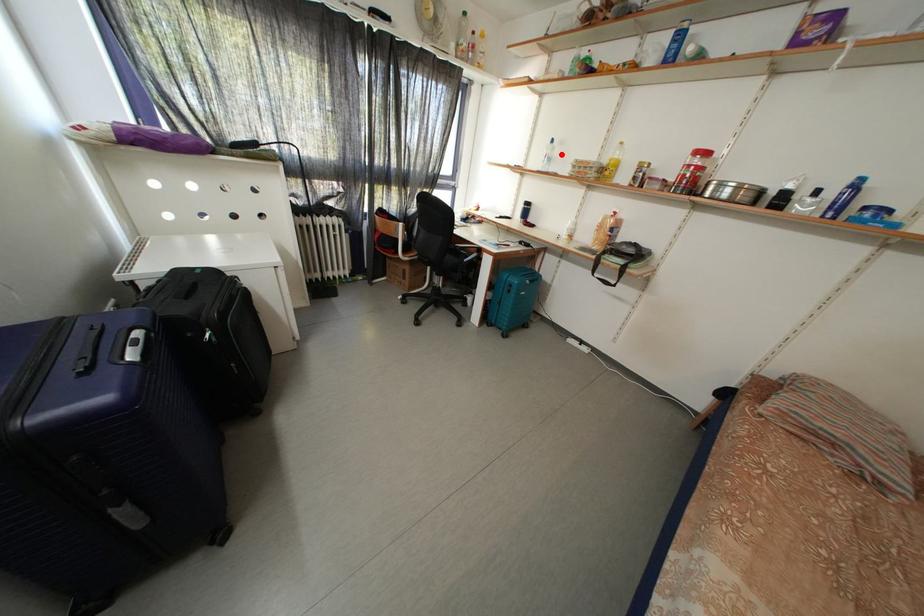
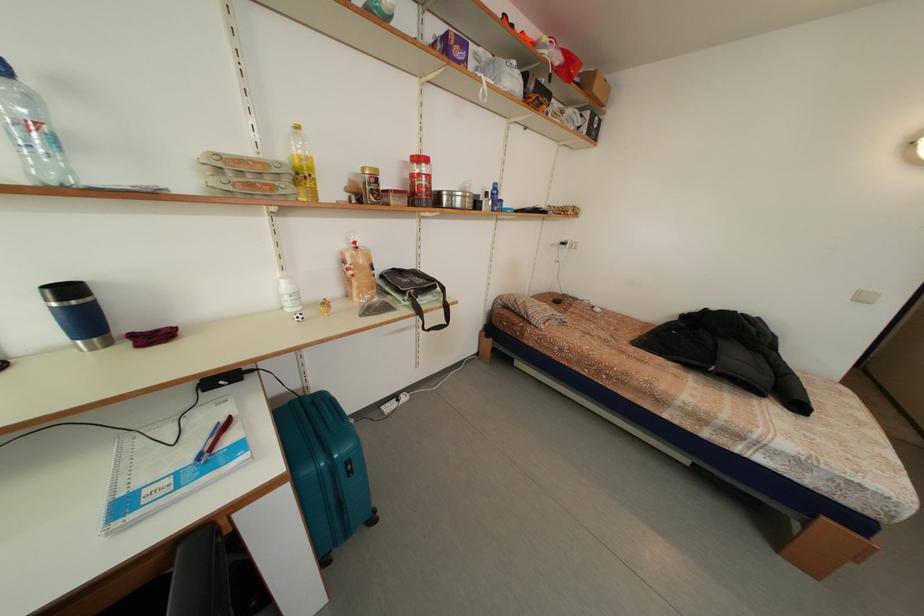
Find the pixel in the second image that matches the highlighted location in the first image.

(40, 106)